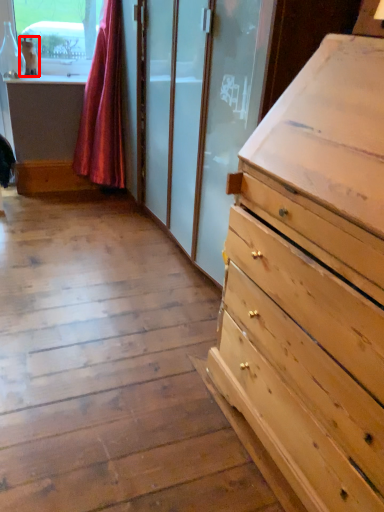
Question: From the image's perspective, considering the relative positions of animal (annotated by the red box) and curtain in the image provided, where is animal (annotated by the red box) located with respect to the staircase?

Choices:
 (A) below
 (B) above

Answer: (B)